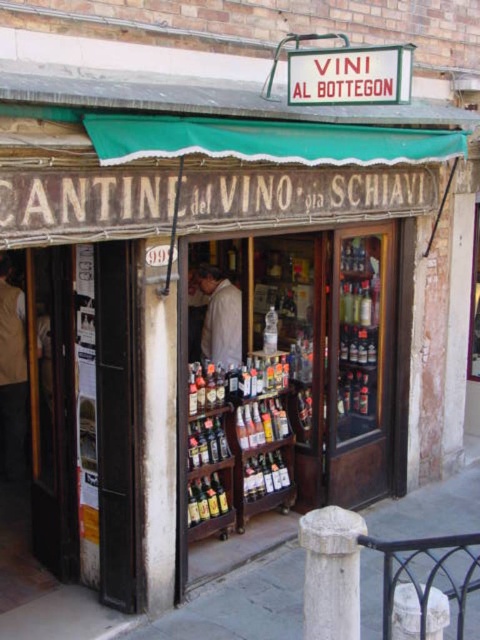
Between white stone post at center and light beige shirt at center, which one is positioned higher?

light beige shirt at center is higher up.

Looking at this image, who is lower down, white stone post at center or light beige shirt at center?

white stone post at center is below.

Which is behind, point (336, 518) or point (213, 349)?

The point (213, 349) is more distant.

The image size is (480, 640). Identify the location of white stone post at center. (331, 572).

Can you confirm if gray concrete pavement at lower center is positioned to the right of light beige vest at left?

Correct, you'll find gray concrete pavement at lower center to the right of light beige vest at left.

Does gray concrete pavement at lower center have a lesser width compared to light beige vest at left?

Incorrect, gray concrete pavement at lower center's width is not less than light beige vest at left's.

The height and width of the screenshot is (640, 480). What do you see at coordinates (239, 604) in the screenshot?
I see `gray concrete pavement at lower center` at bounding box center [239, 604].

The width and height of the screenshot is (480, 640). In order to click on gray concrete pavement at lower center in this screenshot , I will do `click(239, 604)`.

Does point (299, 568) lie behind point (322, 536)?

Yes, point (299, 568) is farther from viewer.

Consider the image. Is gray concrete pavement at lower center thinner than white stone post at center?

No, gray concrete pavement at lower center is not thinner than white stone post at center.

Describe the element at coordinates (239, 604) in the screenshot. I see `gray concrete pavement at lower center` at that location.

Where is `gray concrete pavement at lower center`? The image size is (480, 640). gray concrete pavement at lower center is located at coordinates (239, 604).